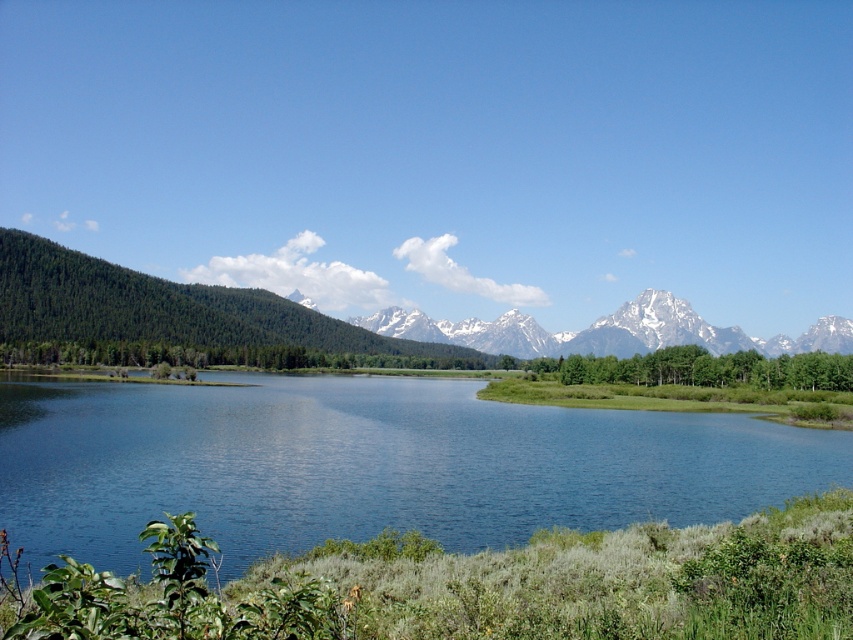
Can you confirm if blue glassy water at center is positioned below green forested mountain range at upper left?

Indeed, blue glassy water at center is positioned under green forested mountain range at upper left.

Does blue glassy water at center have a smaller size compared to green forested mountain range at upper left?

Yes.

Is point (125, 499) closer to camera compared to point (42, 298)?

That is True.

Locate an element on the screen. This screenshot has width=853, height=640. blue glassy water at center is located at coordinates (369, 465).